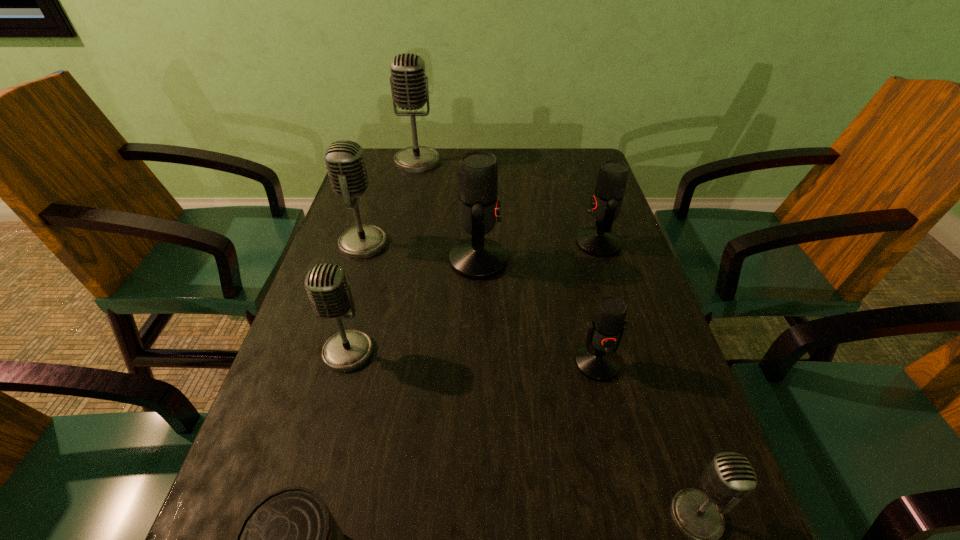
Where is `the biggest gray microphone`? the biggest gray microphone is located at coordinates (409, 85).

Find the location of a particular element. This screenshot has height=540, width=960. the farthest gray microphone is located at coordinates click(x=409, y=85).

Locate an element on the screen. This screenshot has width=960, height=540. the leftmost red microphone is located at coordinates (477, 258).

At what (x,y) coordinates should I click in order to perform the action: click on the biggest red microphone. Please return your answer as a coordinate pair (x, y). This screenshot has height=540, width=960. Looking at the image, I should click on [477, 258].

I want to click on the second biggest gray microphone, so click(x=344, y=159).

The width and height of the screenshot is (960, 540). Find the location of `the second biggest red microphone`. the second biggest red microphone is located at coordinates (599, 241).

Identify the location of the second nearest gray microphone. Image resolution: width=960 pixels, height=540 pixels. (327, 286).

The image size is (960, 540). What are the coordinates of `the smallest red microphone` in the screenshot? It's located at (598, 360).

Locate an element on the screen. This screenshot has height=540, width=960. vacant region located 0.290m on the right of the farthest object is located at coordinates (530, 161).

At what (x,y) coordinates should I click in order to perform the action: click on vacant area situated on the side of the fourth object from right to left with the red ring. Please return your answer as a coordinate pair (x, y). Looking at the image, I should click on (540, 260).